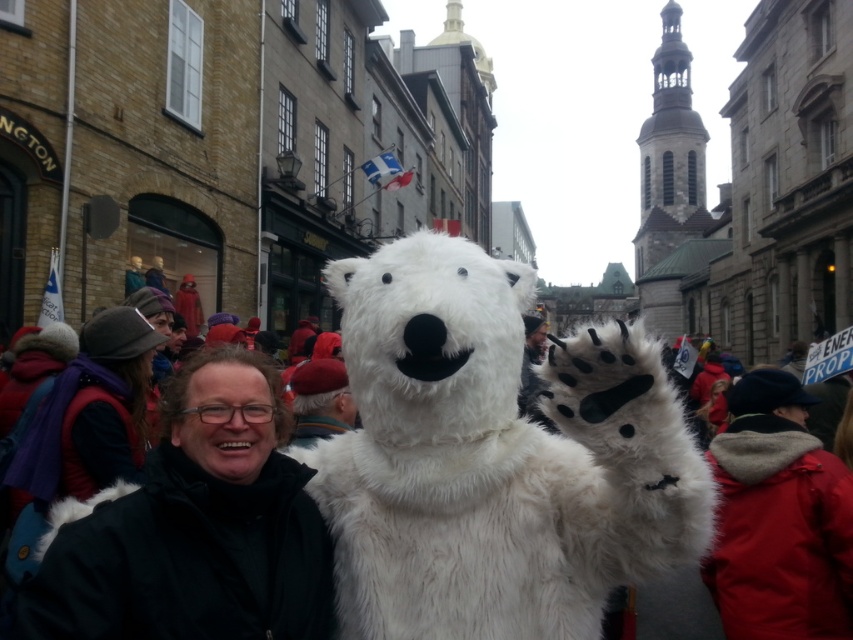
The width and height of the screenshot is (853, 640). What are the coordinates of `black matte jacket at center` in the screenshot? It's located at (194, 528).

Who is more forward, (235, 449) or (729, 422)?

Point (235, 449)

Between point (280, 588) and point (750, 522), which one is positioned behind?

The point (750, 522) is more distant.

Identify the location of black matte jacket at center. (194, 528).

Does white furry teddy bear at center have a lesser width compared to black matte jacket at center?

Incorrect, white furry teddy bear at center's width is not less than black matte jacket at center's.

Is white furry teddy bear at center positioned behind black matte jacket at center?

Yes, it is behind black matte jacket at center.

Between point (592, 570) and point (285, 596), which one is positioned behind?

The point (592, 570) is more distant.

The image size is (853, 640). I want to click on white furry teddy bear at center, so click(494, 458).

Is point (494, 582) positioned after point (850, 627)?

No, (494, 582) is closer to viewer.

Does white furry teddy bear at center lie behind red fur coat at lower right?

No, it is not.

Measure the distance between point (680, 552) and camera.

Point (680, 552) is 33.77 meters away from camera.

Where is `white furry teddy bear at center`? white furry teddy bear at center is located at coordinates (494, 458).